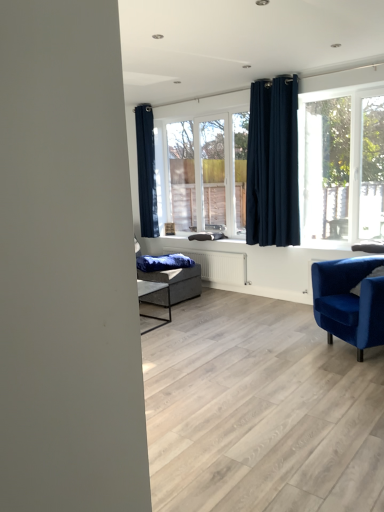
Locate an element on the screen. Image resolution: width=384 pixels, height=512 pixels. velvet blue armchair at lower right is located at coordinates (350, 301).

What do you see at coordinates (273, 164) in the screenshot? I see `dark blue velvet curtain at upper center, which is counted as the first curtain, starting from the right` at bounding box center [273, 164].

Find the location of a particular element. Image resolution: width=384 pixels, height=512 pixels. dark blue fabric curtain at upper left, arranged as the 2th curtain when viewed from the right is located at coordinates (146, 170).

From the image's perspective, is dark blue velvet curtain at upper center, which is counted as the first curtain, starting from the right, on blue velvet blanket at center?

Yes, from the image's perspective, dark blue velvet curtain at upper center, which is counted as the first curtain, starting from the right, is on top of blue velvet blanket at center.

Can you confirm if dark blue velvet curtain at upper center, the 2th curtain in the left-to-right sequence, is taller than blue velvet blanket at center?

Yes.

Based on the photo, which is correct: dark blue velvet curtain at upper center, marked as the 1th curtain in a front-to-back arrangement, is inside blue velvet blanket at center, or outside of it?

dark blue velvet curtain at upper center, marked as the 1th curtain in a front-to-back arrangement, cannot be found inside blue velvet blanket at center.

In the scene shown: Does blue velvet blanket at center have a lesser width compared to dark blue velvet curtain at upper center, the 2th curtain in the left-to-right sequence?

Incorrect, the width of blue velvet blanket at center is not less than that of dark blue velvet curtain at upper center, the 2th curtain in the left-to-right sequence.

Is point (163, 269) closer or farther from the camera than point (263, 166)?

Clearly, point (163, 269) is closer to the camera than point (263, 166).

Looking at this image, is dark blue velvet curtain at upper center, which is counted as the first curtain, starting from the right, a part of blue velvet blanket at center?

No, blue velvet blanket at center does not contain dark blue velvet curtain at upper center, which is counted as the first curtain, starting from the right.

Does blue velvet blanket at center come in front of dark blue velvet curtain at upper center, which is the 2th curtain in back-to-front order?

No, it is not.

Which of these two, velvet blue armchair at lower right or clear glass window at center, is thinner?

With smaller width is clear glass window at center.

Can you tell me how much velvet blue armchair at lower right and clear glass window at center differ in facing direction?

velvet blue armchair at lower right and clear glass window at center are facing 33.7 degrees away from each other.

Considering the positions of objects velvet blue armchair at lower right and clear glass window at center in the image provided, who is in front, velvet blue armchair at lower right or clear glass window at center?

velvet blue armchair at lower right.

Does point (365, 317) come closer to viewer compared to point (192, 133)?

Yes, point (365, 317) is in front of point (192, 133).

Is clear glass window at center a part of blue velvet blanket at center?

Actually, clear glass window at center is outside blue velvet blanket at center.

Is blue velvet blanket at center oriented towards clear glass window at center?

No, blue velvet blanket at center is not oriented towards clear glass window at center.

Considering the relative sizes of blue velvet blanket at center and clear glass window at center in the image provided, is blue velvet blanket at center bigger than clear glass window at center?

Incorrect, blue velvet blanket at center is not larger than clear glass window at center.

Is point (150, 110) closer to camera compared to point (336, 286)?

No.

Does dark blue fabric curtain at upper left, arranged as the 2th curtain when viewed from the right, turn towards velvet blue armchair at lower right?

No, dark blue fabric curtain at upper left, arranged as the 2th curtain when viewed from the right, is not oriented towards velvet blue armchair at lower right.

From the image's perspective, is dark blue fabric curtain at upper left, arranged as the 1th curtain when viewed from the left, located beneath velvet blue armchair at lower right?

No, from the image's perspective, dark blue fabric curtain at upper left, arranged as the 1th curtain when viewed from the left, is not beneath velvet blue armchair at lower right.

Which object is positioned more to the left, dark blue fabric curtain at upper left, which ranks as the first curtain in back-to-front order, or velvet blue armchair at lower right?

Positioned to the left is dark blue fabric curtain at upper left, which ranks as the first curtain in back-to-front order.

Which is behind, blue velvet blanket at center or dark blue fabric curtain at upper left, which ranks as the first curtain in back-to-front order?

Positioned behind is dark blue fabric curtain at upper left, which ranks as the first curtain in back-to-front order.

Which object is thinner, blue velvet blanket at center or dark blue fabric curtain at upper left, arranged as the 1th curtain when viewed from the left?

dark blue fabric curtain at upper left, arranged as the 1th curtain when viewed from the left.

Is blue velvet blanket at center not within dark blue fabric curtain at upper left, arranged as the 2th curtain when viewed from the right?

Yes, blue velvet blanket at center is not within dark blue fabric curtain at upper left, arranged as the 2th curtain when viewed from the right.

Between blue velvet blanket at center and dark blue fabric curtain at upper left, which appears as the second curtain when viewed from the front, which one appears on the right side from the viewer's perspective?

blue velvet blanket at center is more to the right.

In the image, is clear glass window at center positioned in front of or behind blue velvet blanket at center?

clear glass window at center is positioned farther from the viewer than blue velvet blanket at center.

Is clear glass window at center taller or shorter than blue velvet blanket at center?

clear glass window at center is taller than blue velvet blanket at center.

Which of these two, clear glass window at center or blue velvet blanket at center, is thinner?

Thinner between the two is clear glass window at center.

Would you consider clear glass window at center to be distant from blue velvet blanket at center?

Yes, clear glass window at center is far from blue velvet blanket at center.

From the image's perspective, which curtain is the 1st one above the blue velvet blanket at center? Please provide its 2D coordinates.

[(273, 164)]

This screenshot has height=512, width=384. What are the coordinates of `blanket below the dark blue velvet curtain at upper center, the 2th curtain in the left-to-right sequence (from the image's perspective)` in the screenshot? It's located at (163, 262).

Looking at the image, which one is located further to dark blue fabric curtain at upper left, which ranks as the first curtain in back-to-front order, clear glass window at center or dark blue velvet curtain at upper center, which is the 2th curtain in back-to-front order?

dark blue velvet curtain at upper center, which is the 2th curtain in back-to-front order.

Based on their spatial positions, is dark blue velvet curtain at upper center, the 2th curtain in the left-to-right sequence, or velvet blue armchair at lower right further from blue velvet blanket at center?

Among the two, velvet blue armchair at lower right is located further to blue velvet blanket at center.

Consider the image. When comparing their distances from velvet blue armchair at lower right, does clear glass window at center or dark blue fabric curtain at upper left, which appears as the second curtain when viewed from the front, seem further?

The object further to velvet blue armchair at lower right is dark blue fabric curtain at upper left, which appears as the second curtain when viewed from the front.

Estimate the real-world distances between objects in this image. Which object is further from dark blue fabric curtain at upper left, arranged as the 1th curtain when viewed from the left, velvet blue armchair at lower right or clear glass window at center?

Based on the image, velvet blue armchair at lower right appears to be further to dark blue fabric curtain at upper left, arranged as the 1th curtain when viewed from the left.

When comparing their distances from dark blue fabric curtain at upper left, arranged as the 1th curtain when viewed from the left, does clear glass window at center or blue velvet blanket at center seem closer?

clear glass window at center lies closer to dark blue fabric curtain at upper left, arranged as the 1th curtain when viewed from the left, than the other object.

Looking at the image, which one is located closer to dark blue fabric curtain at upper left, arranged as the 2th curtain when viewed from the right, dark blue velvet curtain at upper center, which is counted as the first curtain, starting from the right, or clear glass window at center?

clear glass window at center.

Which object lies nearer to the anchor point blue velvet blanket at center, clear glass window at center or dark blue velvet curtain at upper center, which is counted as the first curtain, starting from the right?

clear glass window at center is positioned closer to the anchor blue velvet blanket at center.

Estimate the real-world distances between objects in this image. Which object is further from dark blue fabric curtain at upper left, which ranks as the first curtain in back-to-front order, clear glass window at center or velvet blue armchair at lower right?

velvet blue armchair at lower right is positioned further to the anchor dark blue fabric curtain at upper left, which ranks as the first curtain in back-to-front order.

What are the coordinates of `window between blue velvet blanket at center and dark blue velvet curtain at upper center, which is the 2th curtain in back-to-front order, in the horizontal direction` in the screenshot? It's located at (203, 168).

Locate an element on the screen. The image size is (384, 512). window between dark blue fabric curtain at upper left, which ranks as the first curtain in back-to-front order, and dark blue velvet curtain at upper center, which is counted as the first curtain, starting from the right is located at coordinates (203, 168).

I want to click on blanket between velvet blue armchair at lower right and clear glass window at center from front to back, so click(163, 262).

This screenshot has width=384, height=512. Identify the location of window positioned between velvet blue armchair at lower right and dark blue fabric curtain at upper left, arranged as the 2th curtain when viewed from the right, from near to far. (203, 168).